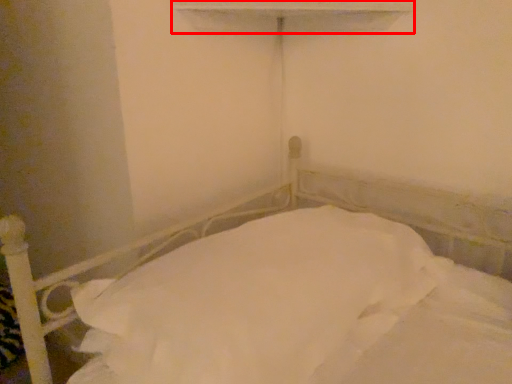
Question: From the image's perspective, where is window sill (annotated by the red box) located relative to bed?

Choices:
 (A) below
 (B) above

Answer: (B)